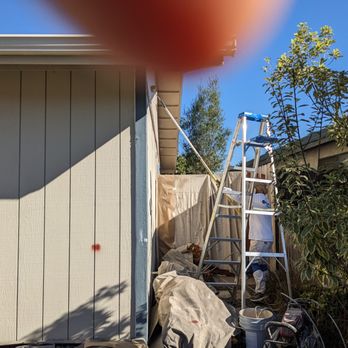
Where is `silver colored meta ladder`? The height and width of the screenshot is (348, 348). silver colored meta ladder is located at coordinates 242,199.